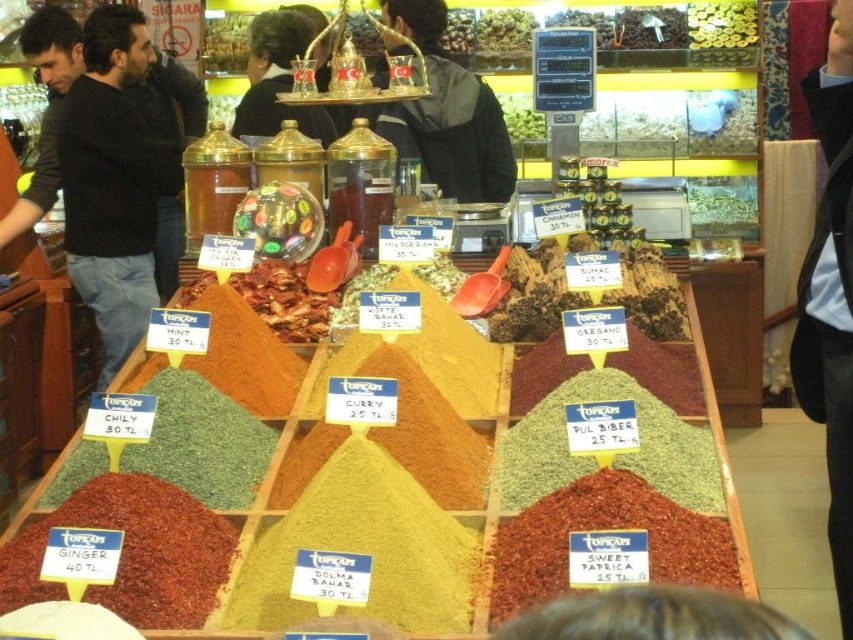
Question: Which object is the farthest from the green leafy vegetables at center?

Choices:
 (A) dark gray jacket at center
 (B) dark brown wood spice at upper center

Answer: (A)

Question: Which point is closer to the camera?

Choices:
 (A) green powder at left
 (B) dark brown wood spice at upper center

Answer: (A)

Question: Is bright red paprika at center further to the viewer compared to green leafy vegetable at center?

Choices:
 (A) yes
 (B) no

Answer: (B)

Question: Which object is positioned closest to the green powder at left?

Choices:
 (A) shiny glass jar at upper center
 (B) green leafy vegetable at center
 (C) brown powder spice at center
 (D) shiny dark chocolate at center

Answer: (C)

Question: Does brown woody sticks at center have a greater width compared to green leafy herbs at center?

Choices:
 (A) no
 (B) yes

Answer: (B)

Question: Can you confirm if dark gray jacket at center is smaller than gold foil coins at upper center?

Choices:
 (A) yes
 (B) no

Answer: (B)